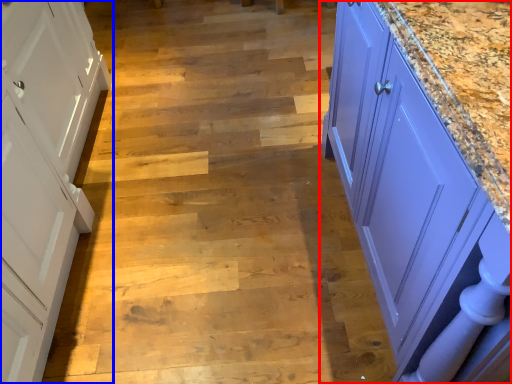
Question: Among these objects, which one is farthest to the camera, countertop (highlighted by a red box) or cabinetry (highlighted by a blue box)?

Choices:
 (A) countertop
 (B) cabinetry

Answer: (B)